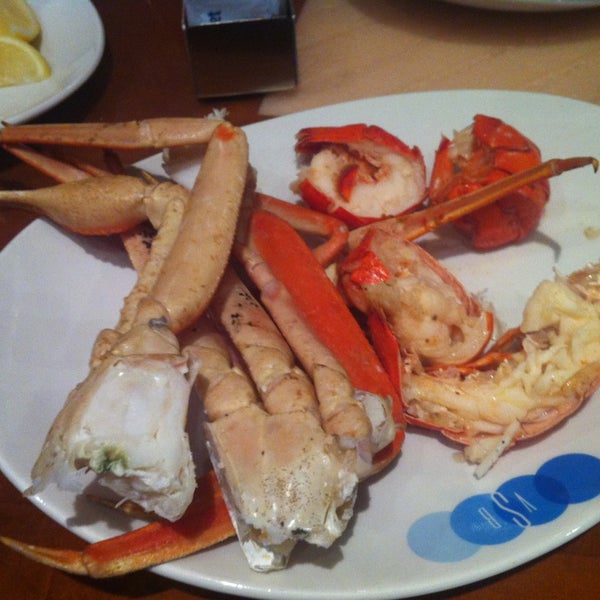
You are a GUI agent. You are given a task and a screenshot of the screen. Output one action in this format:
    pyautogui.click(x=<x>, y=<y>)
    Task: Click on the plate of lemon wedges
    Image resolution: width=600 pixels, height=600 pixels.
    Given the screenshot: What is the action you would take?
    pyautogui.click(x=56, y=31)